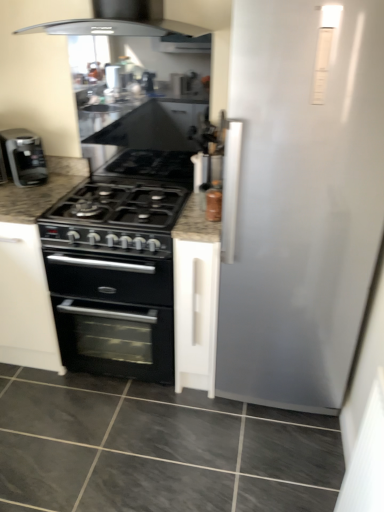
Question: Choose the correct answer: Is gray marble floor at lower center inside black granite countertop at center or outside it?

Choices:
 (A) outside
 (B) inside

Answer: (A)

Question: From the image's perspective, relative to black granite countertop at center, is gray marble floor at lower center above or below?

Choices:
 (A) above
 (B) below

Answer: (B)

Question: Which object is positioned farthest from the black matte coffee machine at left?

Choices:
 (A) granite black stove at center
 (B) black granite countertop at center
 (C) metallic silver spice jar at upper right
 (D) gray marble floor at lower center

Answer: (D)

Question: Based on their relative distances, which object is farther from the black matte coffee machine at left?

Choices:
 (A) metallic silver spice jar at upper right
 (B) gray marble floor at lower center
 (C) granite black stove at center
 (D) black granite countertop at center

Answer: (B)